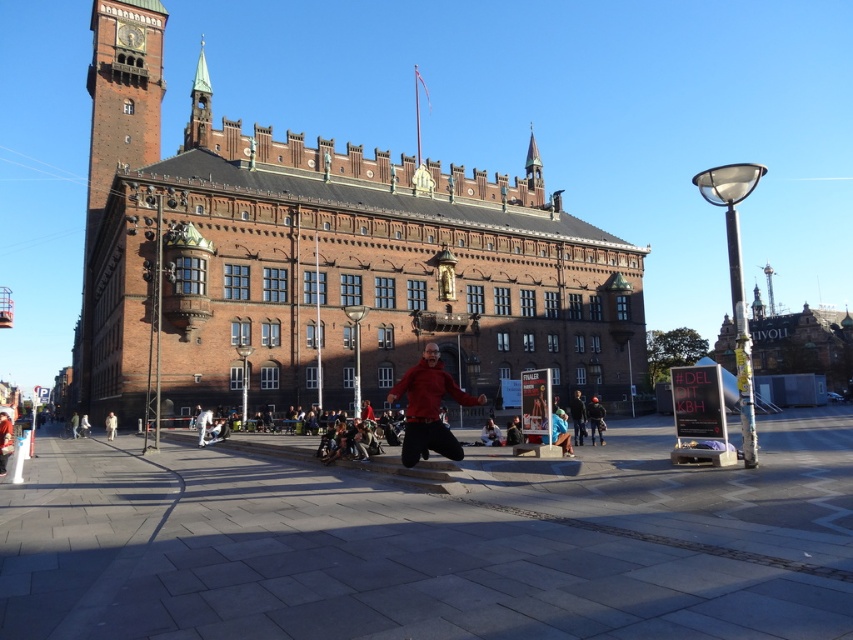
Question: Based on their relative distances, which object is nearer to the dark brown leather jacket at center?

Choices:
 (A) light beige coat at center
 (B) red matte skateboarder at center
 (C) brick tower at left
 (D) matte red pants at center

Answer: (D)

Question: Is brick tower at left to the left of dark brown leather jacket at center from the viewer's perspective?

Choices:
 (A) yes
 (B) no

Answer: (A)

Question: Estimate the real-world distances between objects in this image. Which object is farther from the brick tower at left?

Choices:
 (A) red matte skateboarder at center
 (B) matte red pants at center
 (C) dark blue jeans at lower right

Answer: (C)

Question: Can you confirm if brick tower at left is positioned above light beige coat at center?

Choices:
 (A) no
 (B) yes

Answer: (B)

Question: Is red matte skateboarder at center closer to the viewer compared to matte red pants at center?

Choices:
 (A) yes
 (B) no

Answer: (A)

Question: Estimate the real-world distances between objects in this image. Which object is farther from the dark blue jeans at lower right?

Choices:
 (A) dark brown leather jacket at center
 (B) light beige coat at center
 (C) brick tower at left
 (D) matte red pants at center

Answer: (C)